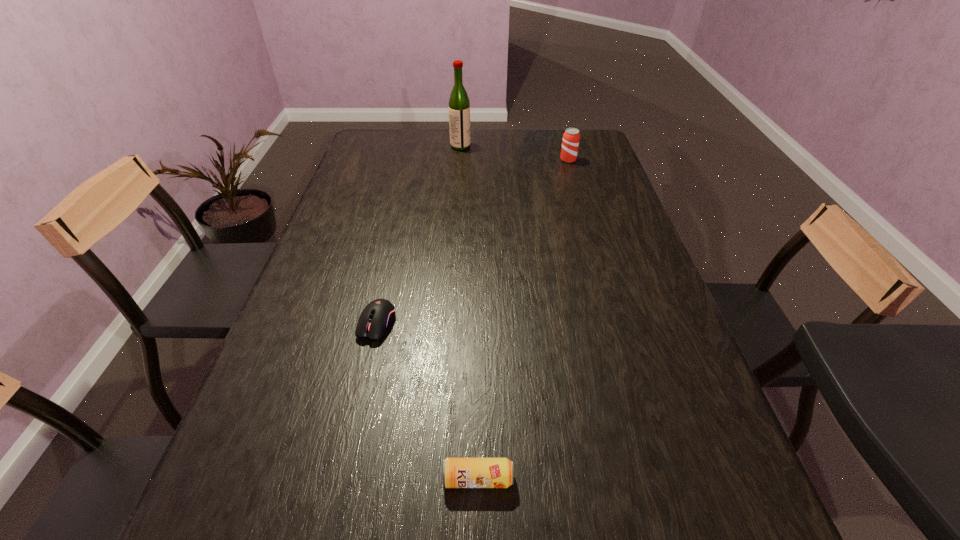
I want to click on free space located on the back of the computer mouse, so click(x=395, y=245).

The height and width of the screenshot is (540, 960). Find the location of `vacant space situated on the back of the shorter beer can`. vacant space situated on the back of the shorter beer can is located at coordinates [x=478, y=317].

Find the location of `liquor positioned at the far edge`. liquor positioned at the far edge is located at coordinates (459, 105).

Where is `beer can that is at the far edge`? The image size is (960, 540). beer can that is at the far edge is located at coordinates (570, 143).

This screenshot has width=960, height=540. Find the location of `object that is positioned at the right edge`. object that is positioned at the right edge is located at coordinates (570, 143).

Find the location of a particular element. object that is positioned at the far right corner is located at coordinates (570, 143).

The image size is (960, 540). In the image, there is a desktop. What are the coordinates of `blank space at the far edge` in the screenshot? It's located at (550, 154).

Where is `free space at the left edge of the desktop`? This screenshot has height=540, width=960. free space at the left edge of the desktop is located at coordinates (332, 256).

Locate an element on the screen. This screenshot has height=540, width=960. blank space at the right edge of the desktop is located at coordinates (666, 313).

The width and height of the screenshot is (960, 540). In the image, there is a desktop. Find the location of `vacant space at the far left corner`. vacant space at the far left corner is located at coordinates pyautogui.click(x=397, y=145).